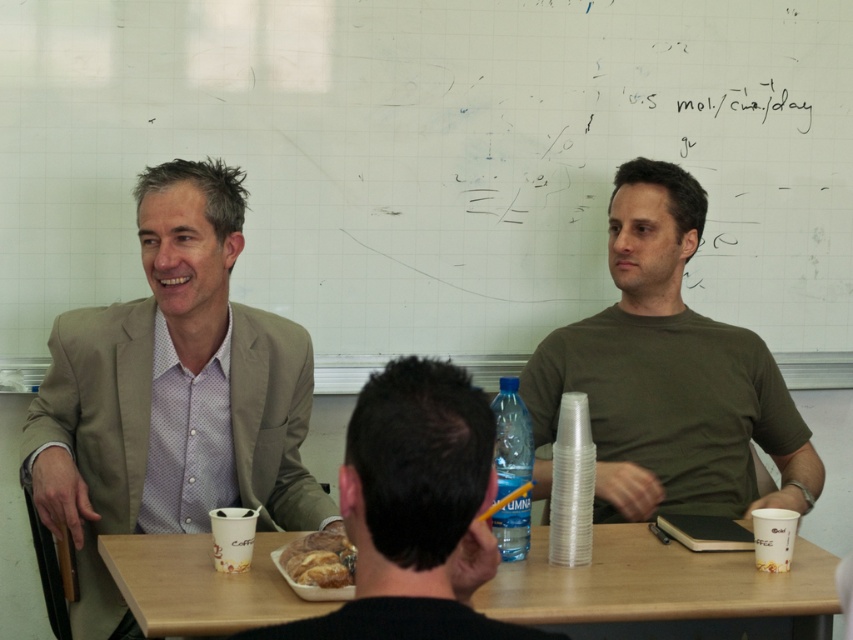
Can you confirm if black matte shirt at center is positioned above golden brown crusty bread at center?

Indeed, black matte shirt at center is positioned over golden brown crusty bread at center.

Can you confirm if black matte shirt at center is positioned below golden brown crusty bread at center?

Actually, black matte shirt at center is above golden brown crusty bread at center.

Is point (384, 410) closer to viewer compared to point (328, 540)?

Yes, point (384, 410) is in front of point (328, 540).

Image resolution: width=853 pixels, height=640 pixels. In order to click on black matte shirt at center in this screenshot , I will do `click(415, 512)`.

Is light brown suit at left above black matte shirt at center?

Correct, light brown suit at left is located above black matte shirt at center.

Can you confirm if light brown suit at left is taller than black matte shirt at center?

Yes.

Which is in front, point (311, 483) or point (405, 508)?

Point (405, 508) is in front.

I want to click on light brown suit at left, so click(171, 396).

Between light brown suit at left and golden brown crusty bread at center, which one appears on the right side from the viewer's perspective?

golden brown crusty bread at center is more to the right.

Is light brown suit at left to the left of golden brown crusty bread at center from the viewer's perspective?

Correct, you'll find light brown suit at left to the left of golden brown crusty bread at center.

Is point (83, 596) in front of point (310, 557)?

No, (83, 596) is behind (310, 557).

The image size is (853, 640). I want to click on light brown suit at left, so click(171, 396).